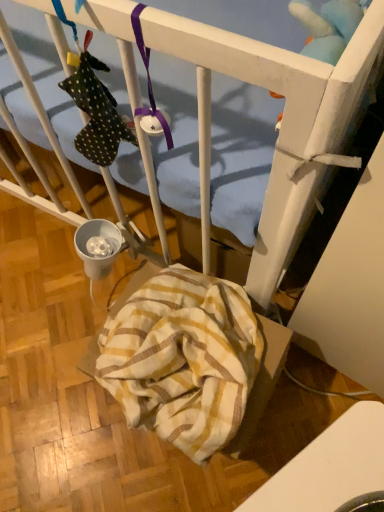
Question: Is yellow striped fabric at lower center surrounded by blue plush toy at upper right?

Choices:
 (A) no
 (B) yes

Answer: (A)

Question: Is blue plush toy at upper right taller than yellow striped fabric at lower center?

Choices:
 (A) yes
 (B) no

Answer: (B)

Question: Considering the relative sizes of blue plush toy at upper right and yellow striped fabric at lower center in the image provided, is blue plush toy at upper right shorter than yellow striped fabric at lower center?

Choices:
 (A) yes
 (B) no

Answer: (A)

Question: From the image's perspective, does blue plush toy at upper right appear higher than yellow striped fabric at lower center?

Choices:
 (A) yes
 (B) no

Answer: (A)

Question: Is blue plush toy at upper right touching yellow striped fabric at lower center?

Choices:
 (A) no
 (B) yes

Answer: (A)

Question: From a real-world perspective, is blue plush toy at upper right physically located above or below yellow striped fabric at lower center?

Choices:
 (A) above
 (B) below

Answer: (A)

Question: Is blue plush toy at upper right situated inside yellow striped fabric at lower center or outside?

Choices:
 (A) outside
 (B) inside

Answer: (A)

Question: Based on their positions, is blue plush toy at upper right located to the left or right of yellow striped fabric at lower center?

Choices:
 (A) right
 (B) left

Answer: (A)

Question: From the image's perspective, is blue plush toy at upper right above or below yellow striped fabric at lower center?

Choices:
 (A) below
 (B) above

Answer: (B)

Question: Is white glossy table at lower right bigger or smaller than blue plush toy at upper right?

Choices:
 (A) small
 (B) big

Answer: (B)

Question: In terms of width, does white glossy table at lower right look wider or thinner when compared to blue plush toy at upper right?

Choices:
 (A) wide
 (B) thin

Answer: (A)

Question: From the image's perspective, is white glossy table at lower right above or below blue plush toy at upper right?

Choices:
 (A) above
 (B) below

Answer: (B)

Question: From a real-world perspective, relative to blue plush toy at upper right, is white glossy table at lower right vertically above or below?

Choices:
 (A) above
 (B) below

Answer: (B)

Question: From a real-world perspective, relative to white glossy table at lower right, is blue plush toy at upper right vertically above or below?

Choices:
 (A) above
 (B) below

Answer: (A)

Question: Considering the positions of blue plush toy at upper right and white glossy table at lower right in the image, is blue plush toy at upper right taller or shorter than white glossy table at lower right?

Choices:
 (A) short
 (B) tall

Answer: (A)